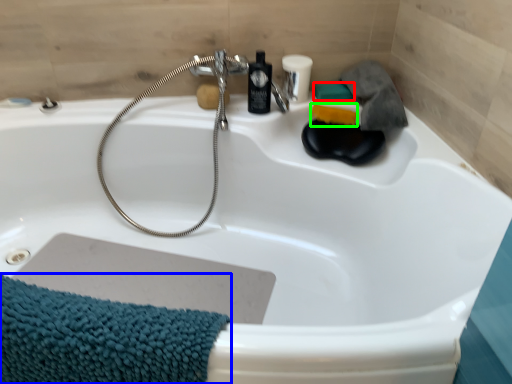
Question: Considering the real-world distances, which object is closest to soap (highlighted by a red box)? bath towel (highlighted by a blue box) or soap (highlighted by a green box).

Choices:
 (A) bath towel
 (B) soap

Answer: (B)